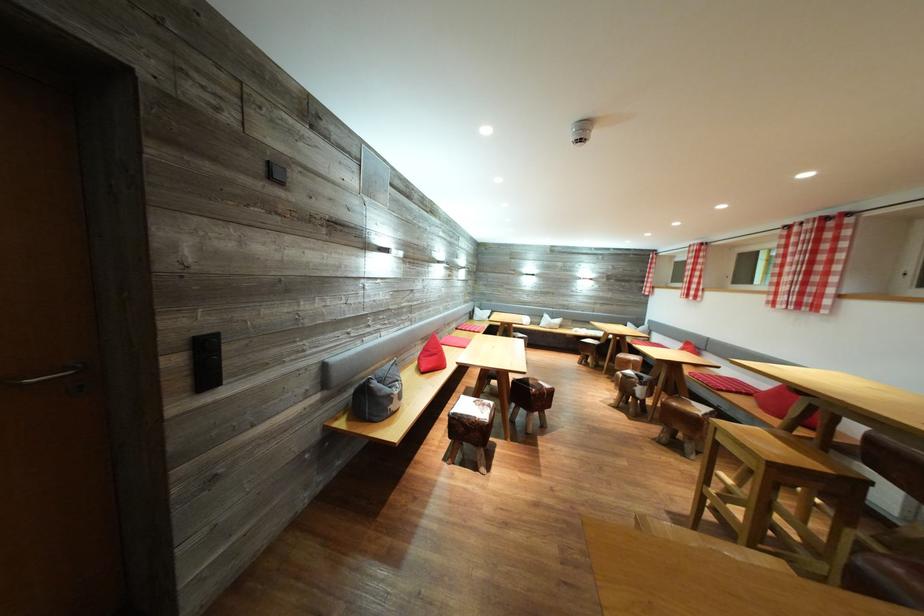
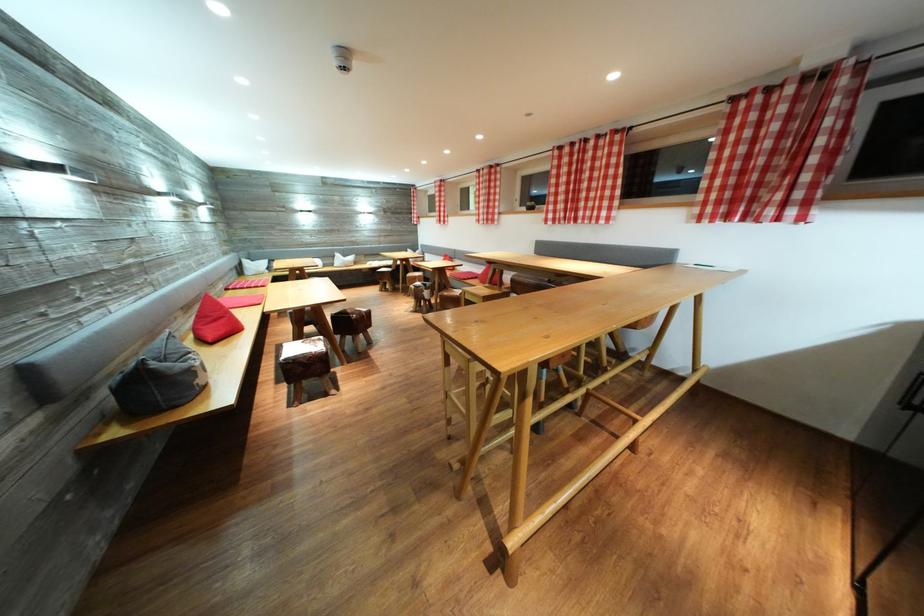
The point at (593, 362) is marked in the first image. Where is the corresponding point in the second image?

(393, 289)